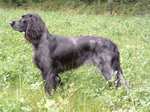
Find the location of `right front leg`. right front leg is located at coordinates (58, 78).